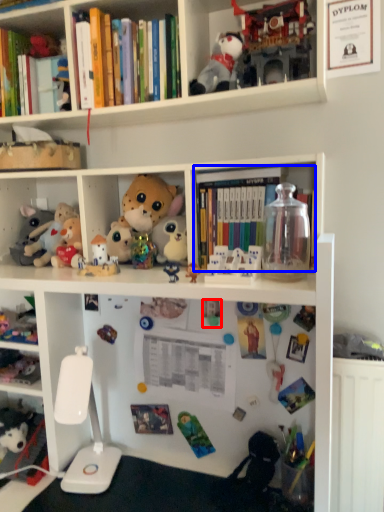
Question: Which object appears closest to the camera in this image, toy (highlighted by a red box) or book (highlighted by a blue box)?

Choices:
 (A) toy
 (B) book

Answer: (B)